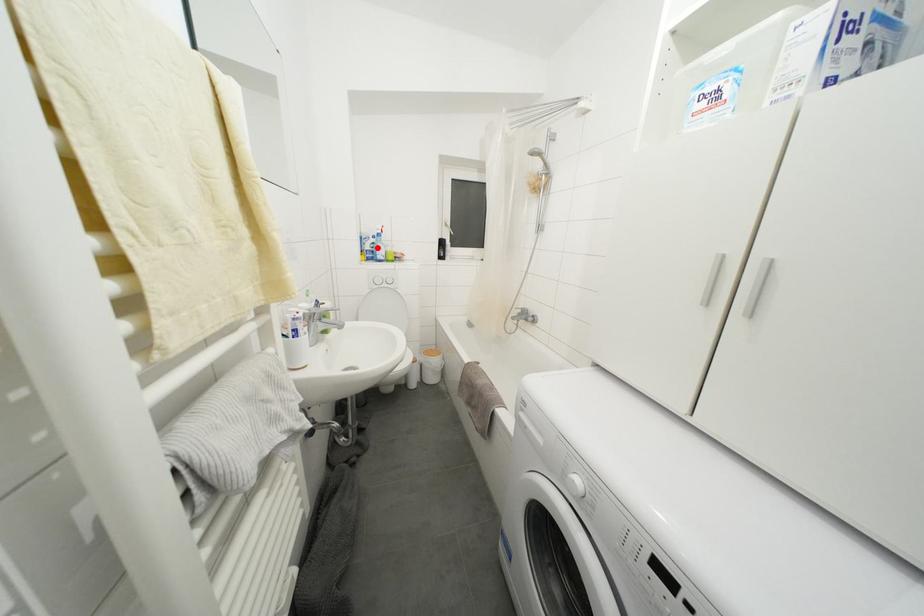
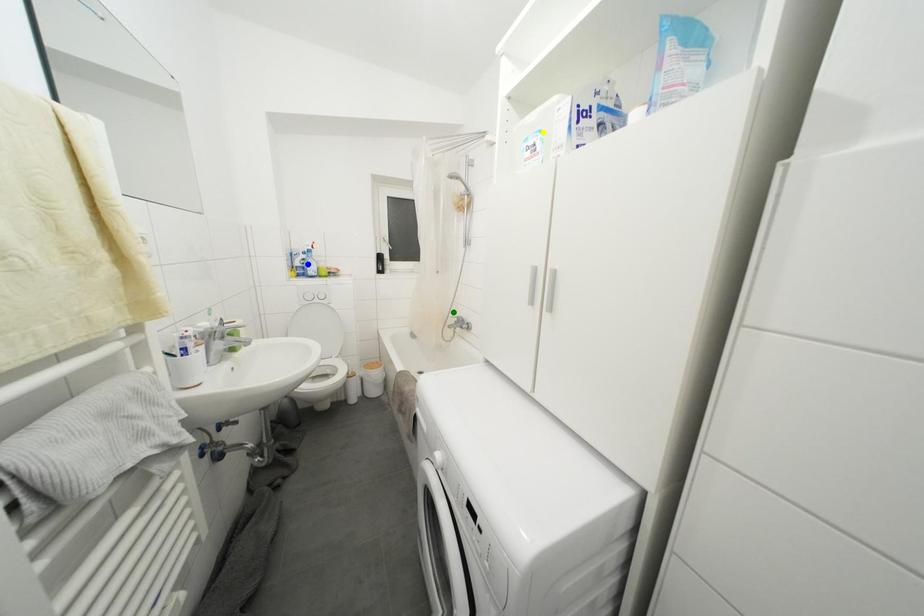
Question: I am providing you with two images of the same scene from different viewpoints. A red point is marked on the first image. You are given multiple points on the second image. Which mark in image 2 goes with the point in image 1?

Choices:
 (A) blue point
 (B) green point
 (C) yellow point

Answer: (A)